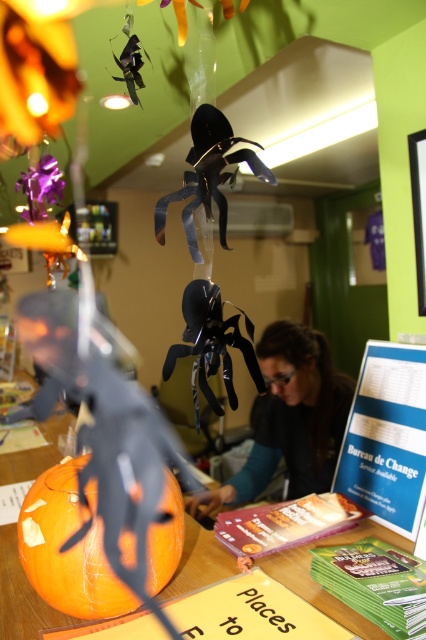
Locate an element on the screen. This screenshot has height=640, width=426. orange matte pumpkin at center is located at coordinates (68, 548).

Is point (77, 490) farther from camera compared to point (331, 396)?

That is False.

Identify the location of orange matte pumpkin at center. (68, 548).

Between point (46, 541) and point (198, 577), which one is positioned in front?

Point (46, 541) is more forward.

Between orange matte pumpkin at center and orange carved pumpkin at center, which one has less height?

orange carved pumpkin at center is shorter.

The height and width of the screenshot is (640, 426). I want to click on orange matte pumpkin at center, so click(x=68, y=548).

Find the location of `orange matte pumpkin at center`. orange matte pumpkin at center is located at coordinates (68, 548).

Is point (268, 432) positioned after point (5, 595)?

Yes, point (268, 432) is behind point (5, 595).

Looking at this image, can you confirm if matte black spider at center is wider than orange carved pumpkin at center?

No, matte black spider at center is not wider than orange carved pumpkin at center.

Is point (258, 465) closer to camera compared to point (221, 552)?

No.

Locate an element on the screen. This screenshot has width=426, height=640. matte black spider at center is located at coordinates (290, 419).